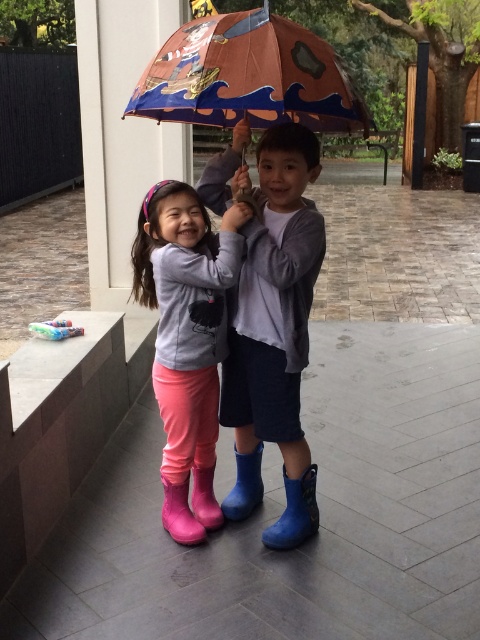
Question: Based on their relative distances, which object is farther from the pink rubber boots at center?

Choices:
 (A) blue rubber boot at lower center
 (B) rubber boots at lower center

Answer: (A)

Question: Considering the real-world distances, which object is closest to the cartoon paper umbrella at center?

Choices:
 (A) rubber boots at lower center
 (B) blue rubber boot at lower center

Answer: (A)

Question: Does pink rubber boots at center come behind blue rubber boot at lower center?

Choices:
 (A) yes
 (B) no

Answer: (B)

Question: Can you confirm if blue rubber boots at center is smaller than blue rubber boot at lower center?

Choices:
 (A) no
 (B) yes

Answer: (A)

Question: Based on their relative distances, which object is nearer to the rubber boots at lower center?

Choices:
 (A) blue rubber boot at lower center
 (B) pink rubber boot at lower center
 (C) pink rubber boot at lower left
 (D) pink rubber boots at center

Answer: (B)

Question: Does pink rubber boots at center appear under blue rubber boot at lower center?

Choices:
 (A) yes
 (B) no

Answer: (B)